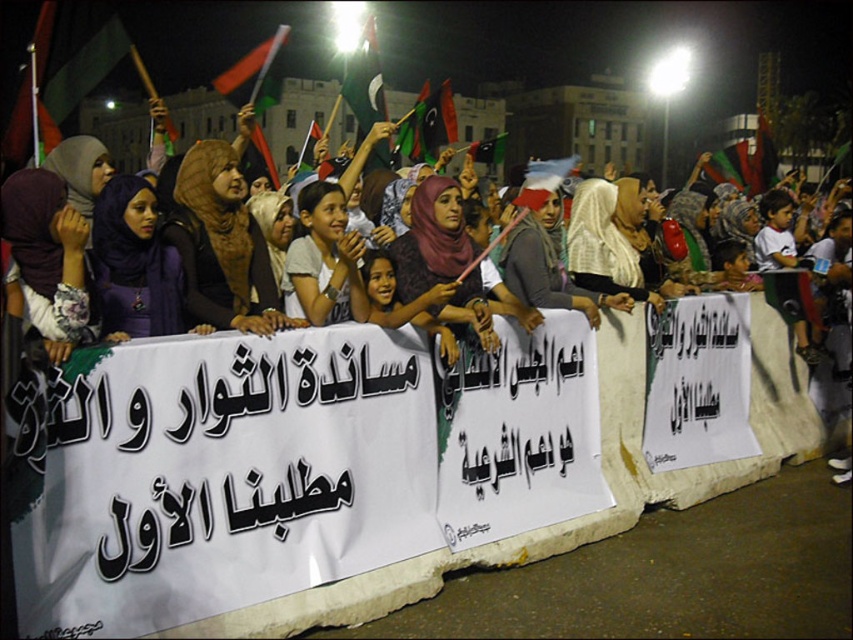
In the scene shown: You are a photographer standing at the edge of the crowd. You want to take a closeup photo of the brown fabric hijab at center without moving closer than 4 meters. Is the distance sufficient for your camera to focus clearly?

The brown fabric hijab at center and viewer are 4.24 meters apart. Since the minimum focusing distance is 4 meters, the camera can focus clearly at 4.24 meters.

Based on the scene description, can you determine the spatial relationship between the white fabric banner at center and the light gray fabric at center? Please refer to their positions relative to each other.

The white fabric banner at center is positioned to the right of the light gray fabric at center.

You are a photographer at the protest scene. You want to capture a photo that includes both the brown fabric hijab at center and the purple matte hijab at center. Which hijab should you focus on to ensure it takes up more space in the photo?

The brown fabric hijab at center is bigger than the purple matte hijab at center, so focusing on it will ensure it takes up more space in the photo.